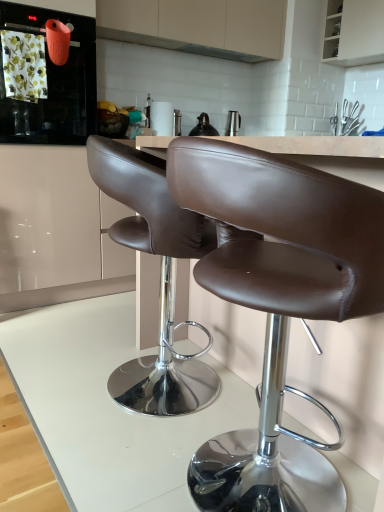
Where is `vacant space positioned to the left of brown leather chair at center, the 1th chair from the front`? vacant space positioned to the left of brown leather chair at center, the 1th chair from the front is located at coordinates [x=72, y=454].